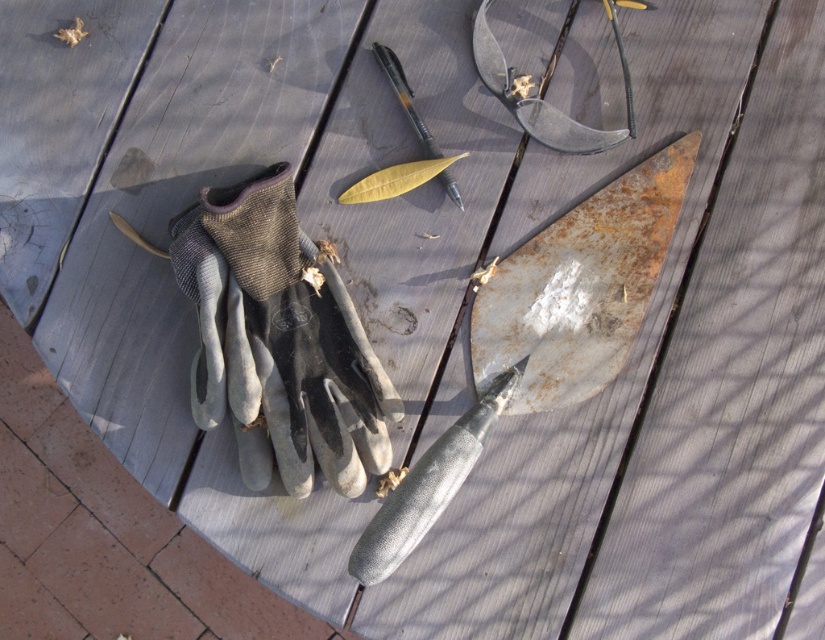
You are organizing items on a wooden deck and need to place the gray fabric glove at center and the rusty metal blade at upper right. Given their sizes, which item will require more space to store?

The gray fabric glove at center requires more space to store since it is larger in size than the rusty metal blade at upper right.

You are organizing tools on a wooden deck. You have a gray fabric glove at center and a matte black pen at center. Where should you place the pen so it doesn not interfere with the glove?

The gray fabric glove at center is to the left of the matte black pen at center, so placing the pen to the right of the glove would keep them separated.

Where is the gray fabric glove at center located in the image?

The gray fabric glove at center is located at point (280, 337) in the image.